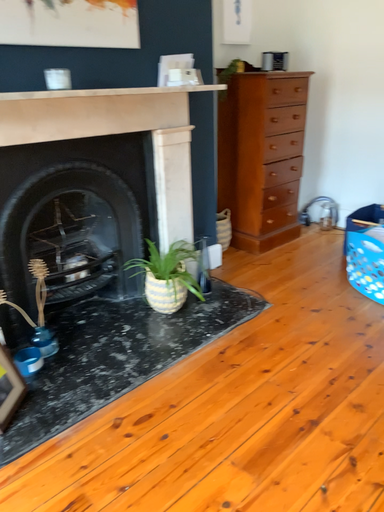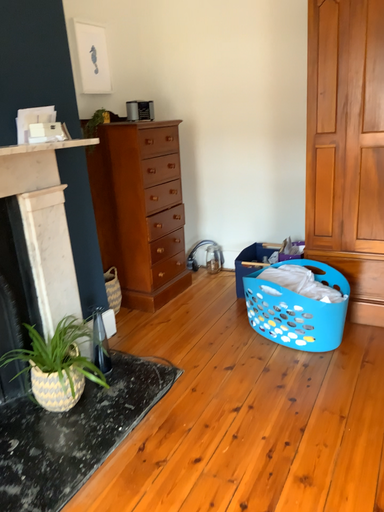
Question: Which way did the camera rotate in the video?

Choices:
 (A) rotated downward
 (B) rotated upward

Answer: (B)